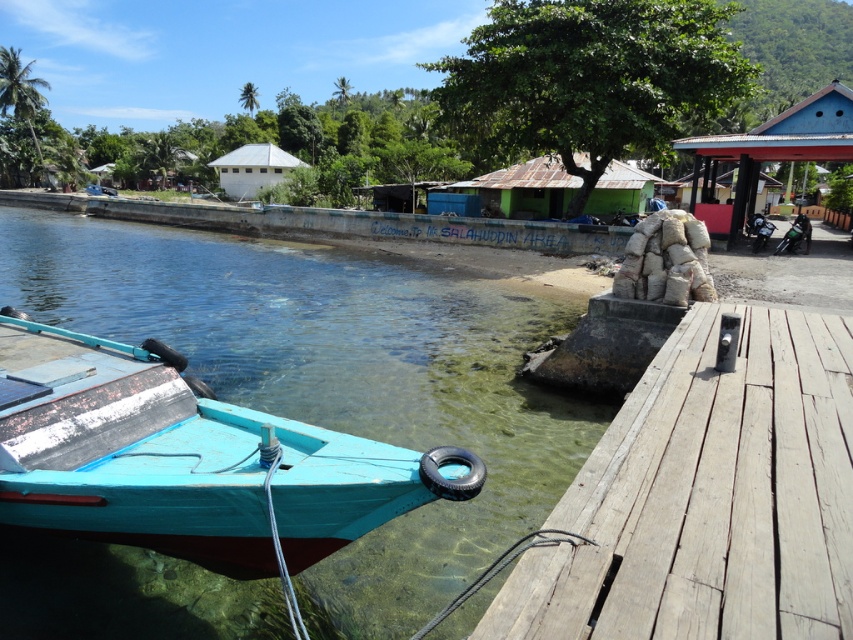
You are standing on the wooden planks at right. Looking towards the boat, which direction should you face?

You should face north because the boat is docked to the north of the wooden planks at right.

You are standing on the wooden planks at right and want to board the teal wooden boat at lower left. Which direction should you move to reach the boat?

You should move towards the lower left direction to reach the teal wooden boat at lower left since the wooden planks at right are further away from the boat.

You are standing on the wooden pier and want to board the teal wooden boat at lower left. If your reach is 2 meters, can you grab anything on the boat without stepping onto it?

The teal wooden boat at lower left is 3.29 meters away from the viewer. Since your reach is only 2 meters, you cannot grab anything on the boat without stepping onto it.